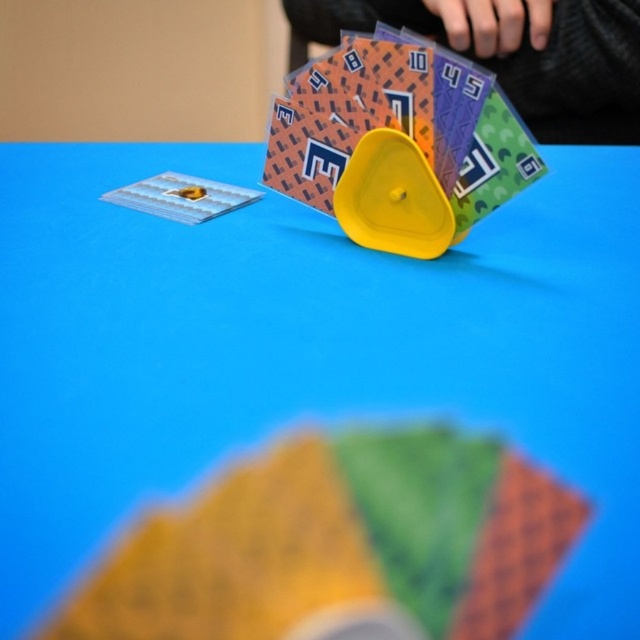
Looking at this image, you are playing a card game and need to place a new card on the table. The existing cards are at the center marked by point (339, 545). Where should you place your new card to ensure it doesn not overlap with the existing ones?

Place the new card away from the center marked by point (339, 545) to avoid overlapping with the existing matte plastic cards at center.

You are playing a card game and need to place a new card between the matte plastic cards at center and the yellow plastic triangle at center. Based on their positions, where should you place the new card?

The matte plastic cards at center is below the yellow plastic triangle at center, so you should place the new card between them by positioning it above the matte plastic cards at center and below the yellow plastic triangle at center.

You are sitting at the table playing a card game. You see two points marked on the table surface. The first point is at coordinate point[134,628] and the second is at point[388,186]. From your perspective, which point is closer to you?

Point[134,628] is in front of point[388,186], so it is closer to you.